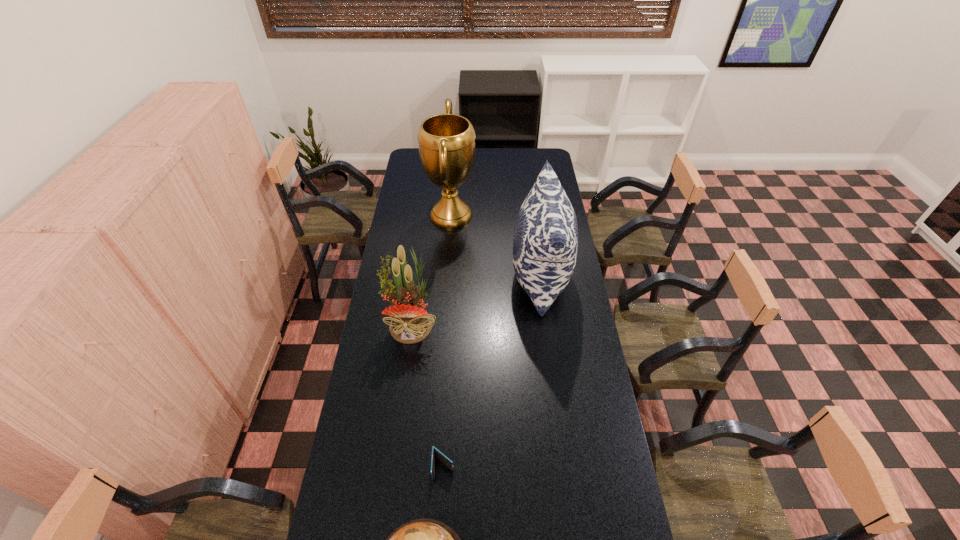
At what (x,y) coordinates should I click in order to perform the action: click on free space located 0.120m on the exterior surface of the shortest object. Please return your answer as a coordinate pair (x, y). This screenshot has height=540, width=960. Looking at the image, I should click on (441, 524).

Find the location of `trophy cup that is at the left edge`. trophy cup that is at the left edge is located at coordinates (446, 142).

Locate an element on the screen. flower arrangement located in the left edge section of the desktop is located at coordinates (410, 323).

What are the coordinates of `object situated at the right edge` in the screenshot? It's located at (545, 246).

I want to click on vacant region at the left edge of the desktop, so click(x=366, y=442).

This screenshot has height=540, width=960. What are the coordinates of `blank space at the right edge of the desktop` in the screenshot? It's located at 564,432.

In the image, there is a desktop. At what (x,y) coordinates should I click in order to perform the action: click on blank space at the far left corner. Please return your answer as a coordinate pair (x, y). This screenshot has width=960, height=540. Looking at the image, I should click on (410, 159).

Identify the location of blank area at the far right corner. (548, 150).

Find the location of a particular element. The image size is (960, 540). empty location between the rightmost object and the flower arrangement is located at coordinates (476, 300).

Where is `free spot between the tallest object and the cushion`? free spot between the tallest object and the cushion is located at coordinates (495, 246).